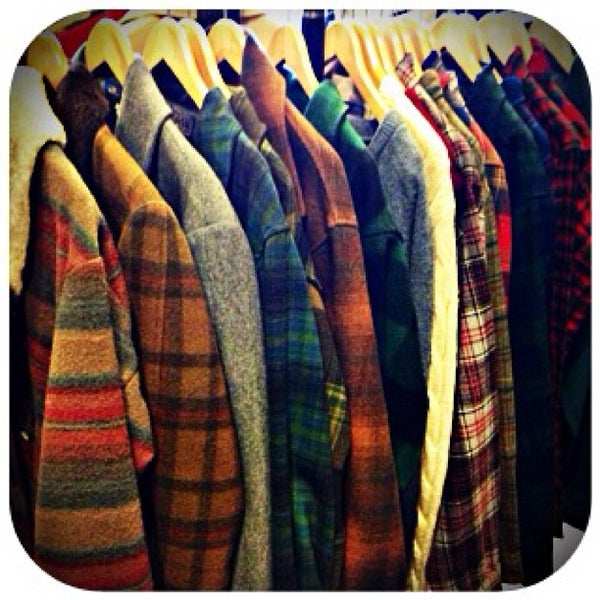
Where is `cloth hanger`? Image resolution: width=600 pixels, height=600 pixels. cloth hanger is located at coordinates (344, 46).